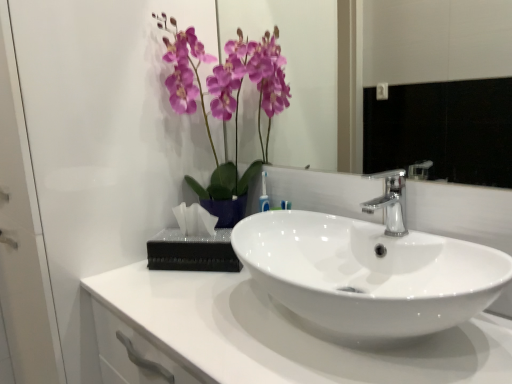
The image size is (512, 384). Describe the element at coordinates (192, 251) in the screenshot. I see `translucent plastic tissue at center` at that location.

What is the approximate width of translucent plastic tissue at center?

translucent plastic tissue at center is 5.86 inches in width.

The image size is (512, 384). Describe the element at coordinates (439, 87) in the screenshot. I see `glossy ceramic mirror at upper center` at that location.

What do you see at coordinates (85, 163) in the screenshot? I see `transparent glass door at upper left` at bounding box center [85, 163].

You are a GUI agent. You are given a task and a screenshot of the screen. Output one action in this format:
    pyautogui.click(x=<x>, y=<y>)
    Task: Click on the purple glossy orchid at upper center
    This screenshot has height=384, width=512.
    Given the screenshot: What is the action you would take?
    pyautogui.click(x=226, y=104)

You are a GUI agent. You are given a task and a screenshot of the screen. Output one action in this format:
    pyautogui.click(x=<x>, y=<y>)
    Task: Click on the translucent plastic tissue at center
    
    Given the screenshot: What is the action you would take?
    pos(192,251)

From their relative heights in the image, would you say transparent glass door at upper left is taller or shorter than white glossy countertop at center?

In the image, transparent glass door at upper left appears to be taller than white glossy countertop at center.

Between transparent glass door at upper left and white glossy countertop at center, which one is positioned behind?

transparent glass door at upper left.

Is transparent glass door at upper left oriented towards white glossy countertop at center?

No, transparent glass door at upper left is not oriented towards white glossy countertop at center.

Can you tell me how much transparent glass door at upper left and white glossy countertop at center differ in facing direction?

The facing directions of transparent glass door at upper left and white glossy countertop at center are 0.351 degrees apart.

Does point (298, 342) appear closer or farther from the camera than point (56, 47)?

Point (298, 342) appears to be closer to the viewer than point (56, 47).

Can you confirm if white glossy countertop at center is thinner than transparent glass door at upper left?

Yes.

Does white glossy countertop at center turn towards transparent glass door at upper left?

No, white glossy countertop at center is not facing towards transparent glass door at upper left.

Is white glossy countertop at center directly adjacent to transparent glass door at upper left?

No, white glossy countertop at center is not with transparent glass door at upper left.

From a real-world perspective, which is physically below, transparent glass door at upper left or translucent plastic tissue at center?

transparent glass door at upper left, from a real-world perspective.

From the picture: Who is shorter, transparent glass door at upper left or translucent plastic tissue at center?

With less height is translucent plastic tissue at center.

Considering the points (28, 146) and (178, 250), which point is behind, point (28, 146) or point (178, 250)?

The point (178, 250) is farther.

Do you think transparent glass door at upper left is within translucent plastic tissue at center, or outside of it?

transparent glass door at upper left lies outside translucent plastic tissue at center.

Considering the relative positions of white glossy countertop at center and purple glossy orchid at upper center in the image provided, is white glossy countertop at center to the right of purple glossy orchid at upper center from the viewer's perspective?

Correct, you'll find white glossy countertop at center to the right of purple glossy orchid at upper center.

From a real-world perspective, which object stands above the other?

purple glossy orchid at upper center, from a real-world perspective.

Can you confirm if white glossy countertop at center is thinner than purple glossy orchid at upper center?

Incorrect, the width of white glossy countertop at center is not less than that of purple glossy orchid at upper center.

Is white glossy countertop at center located outside purple glossy orchid at upper center?

That's correct, white glossy countertop at center is outside of purple glossy orchid at upper center.

Can you tell me how much purple glossy orchid at upper center and transparent glass door at upper left differ in facing direction?

2.1 degrees separate the facing orientations of purple glossy orchid at upper center and transparent glass door at upper left.

Where is `glass door located in front of the purple glossy orchid at upper center`? This screenshot has width=512, height=384. glass door located in front of the purple glossy orchid at upper center is located at coordinates (85, 163).

Considering the relative sizes of purple glossy orchid at upper center and transparent glass door at upper left in the image provided, is purple glossy orchid at upper center bigger than transparent glass door at upper left?

No.

Is purple glossy orchid at upper center positioned with its back to transparent glass door at upper left?

No.

Find the location of a particular element. floral arrangement above the white glossy countertop at center (from the image's perspective) is located at coordinates (226, 104).

From a real-world perspective, does purple glossy orchid at upper center sit lower than white glossy countertop at center?

No, from a real-world perspective, purple glossy orchid at upper center is not below white glossy countertop at center.

Considering the relative sizes of purple glossy orchid at upper center and white glossy countertop at center in the image provided, is purple glossy orchid at upper center wider than white glossy countertop at center?

No.

From a real-world perspective, which is physically above, purple glossy orchid at upper center or glossy ceramic mirror at upper center?

In real-world perspective, glossy ceramic mirror at upper center is above.

Does purple glossy orchid at upper center have a greater width compared to glossy ceramic mirror at upper center?

Correct, the width of purple glossy orchid at upper center exceeds that of glossy ceramic mirror at upper center.

You are a GUI agent. You are given a task and a screenshot of the screen. Output one action in this format:
    pyautogui.click(x=<x>, y=<y>)
    Task: Click on the floral arrangement that appears behind the glossy ceramic mirror at upper center
    The height and width of the screenshot is (384, 512).
    Given the screenshot: What is the action you would take?
    pyautogui.click(x=226, y=104)

Considering the positions of point (175, 68) and point (437, 36), is point (175, 68) closer or farther from the camera than point (437, 36)?

Point (175, 68) is closer to the camera than point (437, 36).

At what (x,y) coordinates should I click in order to perform the action: click on glass door located behind the white glossy countertop at center. Please return your answer as a coordinate pair (x, y). Looking at the image, I should click on (85, 163).

The height and width of the screenshot is (384, 512). What are the coordinates of `glass door above the white glossy countertop at center (from a real-world perspective)` in the screenshot? It's located at (85, 163).

Based on their spatial positions, is white glossy sink at center or translucent plastic tissue at center further from purple glossy orchid at upper center?

white glossy sink at center is further to purple glossy orchid at upper center.

When comparing their distances from transparent glass door at upper left, does purple glossy orchid at upper center or translucent plastic tissue at center seem closer?

purple glossy orchid at upper center lies closer to transparent glass door at upper left than the other object.

Based on their spatial positions, is white glossy sink at center or glossy ceramic mirror at upper center closer to purple glossy orchid at upper center?

white glossy sink at center is closer to purple glossy orchid at upper center.

Consider the image. Based on their spatial positions, is satin nickel faucet at center or glossy ceramic mirror at upper center closer to transparent glass door at upper left?

satin nickel faucet at center is positioned closer to the anchor transparent glass door at upper left.

From the image, which object appears to be nearer to white glossy countertop at center, purple glossy orchid at upper center or white glossy sink at center?

Among the two, white glossy sink at center is located nearer to white glossy countertop at center.

Based on their spatial positions, is white glossy countertop at center or satin nickel faucet at center closer to white glossy sink at center?

satin nickel faucet at center is positioned closer to the anchor white glossy sink at center.

Looking at the image, which one is located closer to satin nickel faucet at center, translucent plastic tissue at center or transparent glass door at upper left?

translucent plastic tissue at center is positioned closer to the anchor satin nickel faucet at center.

Considering their positions, is glossy ceramic mirror at upper center positioned closer to satin nickel faucet at center than transparent glass door at upper left?

transparent glass door at upper left lies closer to satin nickel faucet at center than the other object.

Image resolution: width=512 pixels, height=384 pixels. What are the coordinates of `sink located between transparent glass door at upper left and satin nickel faucet at center in the left-right direction` in the screenshot? It's located at coord(364,265).

Identify the location of tap between purple glossy orchid at upper center and white glossy countertop at center from top to bottom. 389,202.

Locate an element on the screen. sink located between white glossy countertop at center and translucent plastic tissue at center in the depth direction is located at coordinates (364, 265).

This screenshot has height=384, width=512. What are the coordinates of `mirror between translucent plastic tissue at center and satin nickel faucet at center` in the screenshot? It's located at (439, 87).